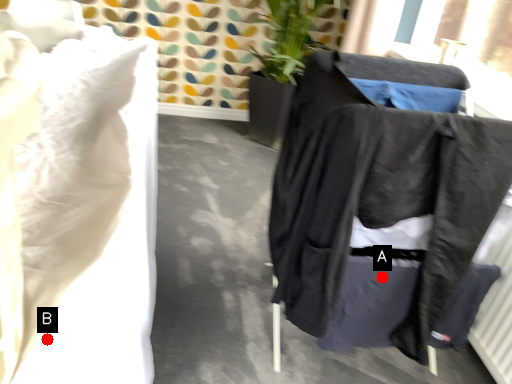
Question: Two points are circled on the image, labeled by A and B beside each circle. Which point is closer to the camera?

Choices:
 (A) A is closer
 (B) B is closer

Answer: (B)